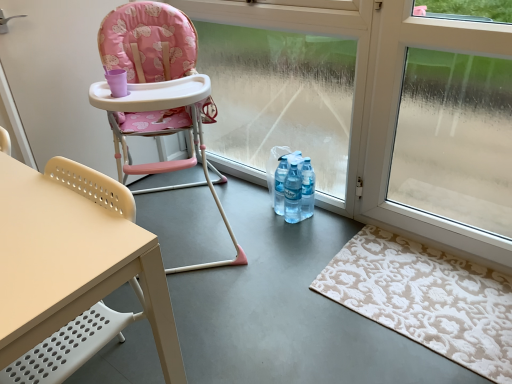
The width and height of the screenshot is (512, 384). I want to click on vacant area that lies between translucent plastic bottles at center and beige textured rug at lower right, so click(x=318, y=237).